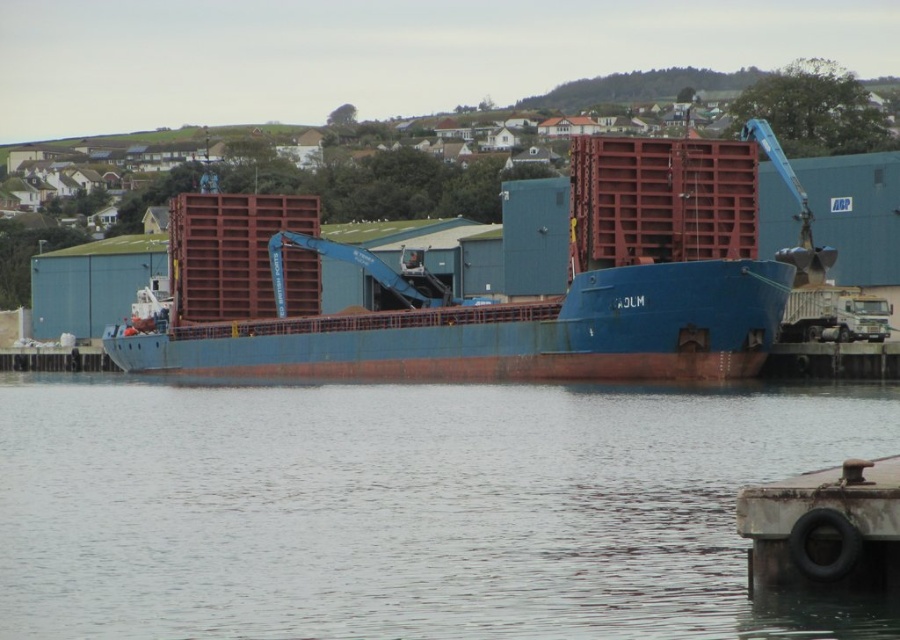
Consider the image. You are a port inspector assessing the docking area. You notice the transparent water at center and the blue matte container ship at center. Which object occupies a larger area in the image?

The blue matte container ship at center occupies a larger area in the image compared to the transparent water at center, as stated in the description that the transparent water at center has a smaller size compared to blue matte container ship at center.

You are a port supervisor checking the docking area. You see the transparent water at center and the blue matte container ship at center. Which object is located to the right of the other?

The transparent water at center is positioned on the right side of blue matte container ship at center, so the transparent water at center is to the right of the blue matte container ship at center.

You are standing on the deck of the cargo ship and want to avoid stepping into the transparent water at center. Based on the coordinates provided, where should you place your feet to stay dry?

The transparent water at center is located at point (406, 508), so you should avoid that coordinate and step elsewhere to stay dry.